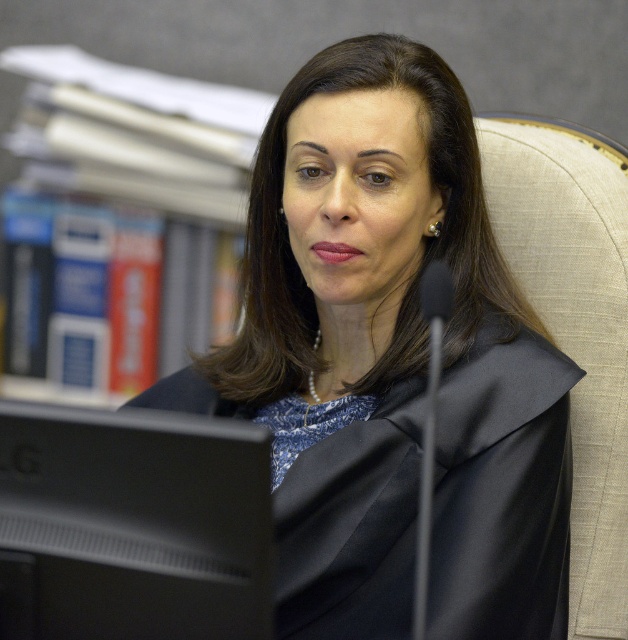
Question: Can you confirm if matte black robe at center is thinner than black matte monitor at lower left?

Choices:
 (A) no
 (B) yes

Answer: (A)

Question: Does matte black robe at center have a lesser width compared to black matte monitor at lower left?

Choices:
 (A) yes
 (B) no

Answer: (B)

Question: Which of the following is the closest to the observer?

Choices:
 (A) black matte monitor at lower left
 (B) matte black robe at center

Answer: (A)

Question: Does matte black robe at center appear under black matte monitor at lower left?

Choices:
 (A) yes
 (B) no

Answer: (B)

Question: Among these points, which one is nearest to the camera?

Choices:
 (A) (266, 572)
 (B) (214, 353)

Answer: (A)